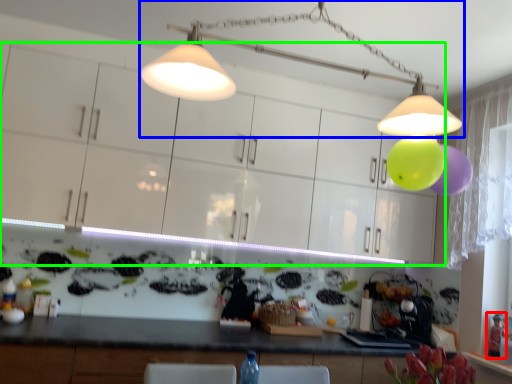
Question: Considering the real-world distances, which object is closest to toy (highlighted by a red box)? lamp (highlighted by a blue box) or cabinetry (highlighted by a green box).

Choices:
 (A) lamp
 (B) cabinetry

Answer: (B)